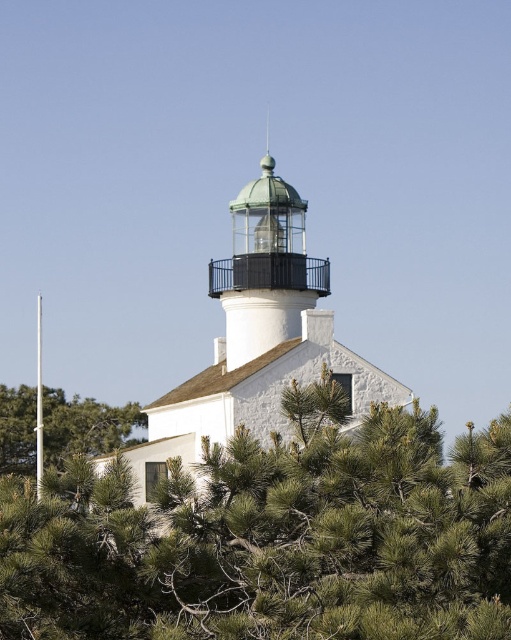
You are a photographer standing at the base of the lighthouse. You want to capture a closeup shot of the metallic glass dome at center. Given that your camera has a maximum zoom range of 100 meters, will you be able to focus on the dome without moving closer?

The metallic glass dome at center is 107.72 meters away from the camera. Since the camera can only zoom up to 100 meters, you won need to move closer to focus on the dome.